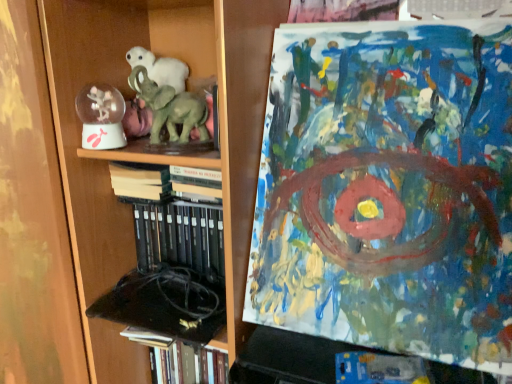
Where is `hardcover books at center, the 2th book in the bottom-to-top sequence`? Image resolution: width=512 pixels, height=384 pixels. hardcover books at center, the 2th book in the bottom-to-top sequence is located at coordinates (163, 181).

In order to face clear plastic snow globe at left, should I rotate leftwards or rightwards?

To align with it, rotate left about 19.491°.

The width and height of the screenshot is (512, 384). What do you see at coordinates (101, 117) in the screenshot?
I see `clear plastic snow globe at left` at bounding box center [101, 117].

The height and width of the screenshot is (384, 512). I want to click on hardcover book at lower left, placed as the first book when sorted from bottom to top, so click(x=181, y=359).

The width and height of the screenshot is (512, 384). What do you see at coordinates (143, 142) in the screenshot? I see `wooden bookcase at left` at bounding box center [143, 142].

Where is `abstract acrylic painting at upper right`? The width and height of the screenshot is (512, 384). abstract acrylic painting at upper right is located at coordinates (389, 189).

Is green matte elephant at center situated inside clear plastic snow globe at left or outside?

green matte elephant at center is outside clear plastic snow globe at left.

From the picture: Considering the sizes of objects green matte elephant at center and clear plastic snow globe at left in the image provided, who is smaller, green matte elephant at center or clear plastic snow globe at left?

clear plastic snow globe at left.

This screenshot has width=512, height=384. Find the location of `elephant to the right of clear plastic snow globe at left`. elephant to the right of clear plastic snow globe at left is located at coordinates (170, 108).

Is clear plastic snow globe at left at the back of green matte elephant at center?

green matte elephant at center does not have its back to clear plastic snow globe at left.

Are hardcover book at lower left, placed as the first book when sorted from bottom to top, and hardcover books at center, the first book positioned from the top, making contact?

No, hardcover book at lower left, placed as the first book when sorted from bottom to top, is not with hardcover books at center, the first book positioned from the top.

Can we say hardcover book at lower left, positioned as the 2th book in top-to-bottom order, lies outside hardcover books at center, the first book positioned from the top?

That's correct, hardcover book at lower left, positioned as the 2th book in top-to-bottom order, is outside of hardcover books at center, the first book positioned from the top.

Which is more to the right, hardcover book at lower left, placed as the first book when sorted from bottom to top, or hardcover books at center, the 2th book in the bottom-to-top sequence?

hardcover book at lower left, placed as the first book when sorted from bottom to top, is more to the right.

From a real-world perspective, which is physically above, hardcover book at lower left, placed as the first book when sorted from bottom to top, or hardcover books at center, the first book positioned from the top?

hardcover books at center, the first book positioned from the top, is physically above.

What's the angular difference between green matte elephant at center and hardcover books at center, the first book positioned from the top,'s facing directions?

24.3 degrees.

Does point (160, 141) come closer to viewer compared to point (189, 183)?

Yes.

From the image's perspective, which is below, green matte elephant at center or hardcover books at center, the first book positioned from the top?

hardcover books at center, the first book positioned from the top, appears lower in the image.

Which object is further away from the camera taking this photo, green matte elephant at center or hardcover books at center, the 2th book in the bottom-to-top sequence?

hardcover books at center, the 2th book in the bottom-to-top sequence, is behind.

Between point (86, 196) and point (165, 357), which one is positioned in front?

The point (86, 196) is in front.

From a real-world perspective, is wooden bookcase at left physically above hardcover book at lower left, positioned as the 2th book in top-to-bottom order?

Correct, in the physical world, wooden bookcase at left is higher than hardcover book at lower left, positioned as the 2th book in top-to-bottom order.

Does wooden bookcase at left have a lesser height compared to hardcover book at lower left, positioned as the 2th book in top-to-bottom order?

No.

Which is more to the left, hardcover books at center, the first book positioned from the top, or abstract acrylic painting at upper right?

hardcover books at center, the first book positioned from the top.

Locate an element on the screen. art above the hardcover books at center, the 2th book in the bottom-to-top sequence (from a real-world perspective) is located at coordinates (389, 189).

Considering the relative sizes of clear plastic snow globe at left and hardcover books at center, the first book positioned from the top, in the image provided, is clear plastic snow globe at left smaller than hardcover books at center, the first book positioned from the top,?

Yes, clear plastic snow globe at left is smaller than hardcover books at center, the first book positioned from the top.

Is clear plastic snow globe at left surrounding hardcover books at center, the 2th book in the bottom-to-top sequence?

No.

How far apart are clear plastic snow globe at left and hardcover books at center, the 2th book in the bottom-to-top sequence?

They are 5.75 inches apart.

Considering the relative positions of clear plastic snow globe at left and hardcover books at center, the 2th book in the bottom-to-top sequence, in the image provided, is clear plastic snow globe at left to the left or to the right of hardcover books at center, the 2th book in the bottom-to-top sequence,?

From the image, it's evident that clear plastic snow globe at left is to the left of hardcover books at center, the 2th book in the bottom-to-top sequence.

From the image's perspective, which one is positioned higher, wooden bookcase at left or green matte elephant at center?

green matte elephant at center.

Does wooden bookcase at left have a greater height compared to green matte elephant at center?

Indeed, wooden bookcase at left has a greater height compared to green matte elephant at center.

Based on the photo, would you say wooden bookcase at left is outside green matte elephant at center?

Yes, wooden bookcase at left is outside of green matte elephant at center.

How distant is wooden bookcase at left from green matte elephant at center?

The distance of wooden bookcase at left from green matte elephant at center is 21.56 centimeters.

Find the location of a particular element. The image size is (512, 384). toy below the green matte elephant at center (from the image's perspective) is located at coordinates (101, 117).

The height and width of the screenshot is (384, 512). Find the location of `book lying in front of the hardcover book at lower left, positioned as the 2th book in top-to-bottom order`. book lying in front of the hardcover book at lower left, positioned as the 2th book in top-to-bottom order is located at coordinates (x=163, y=181).

Estimate the real-world distances between objects in this image. Which object is closer to abstract acrylic painting at upper right, clear plastic snow globe at left or hardcover books at center, the first book positioned from the top?

hardcover books at center, the first book positioned from the top, is positioned closer to the anchor abstract acrylic painting at upper right.

Based on their spatial positions, is hardcover book at lower left, positioned as the 2th book in top-to-bottom order, or clear plastic snow globe at left further from abstract acrylic painting at upper right?

Based on the image, clear plastic snow globe at left appears to be further to abstract acrylic painting at upper right.

From the image, which object appears to be nearer to clear plastic snow globe at left, abstract acrylic painting at upper right or hardcover book at lower left, placed as the first book when sorted from bottom to top?

abstract acrylic painting at upper right lies closer to clear plastic snow globe at left than the other object.

From the image, which object appears to be nearer to abstract acrylic painting at upper right, clear plastic snow globe at left or green matte elephant at center?

Based on the image, green matte elephant at center appears to be nearer to abstract acrylic painting at upper right.

Looking at the image, which one is located further to wooden bookcase at left, abstract acrylic painting at upper right or hardcover books at center, the 2th book in the bottom-to-top sequence?

abstract acrylic painting at upper right lies further to wooden bookcase at left than the other object.

Which object lies nearer to the anchor point green matte elephant at center, clear plastic snow globe at left or abstract acrylic painting at upper right?

Among the two, clear plastic snow globe at left is located nearer to green matte elephant at center.

Based on their spatial positions, is hardcover books at center, the first book positioned from the top, or hardcover book at lower left, positioned as the 2th book in top-to-bottom order, further from wooden bookcase at left?

hardcover book at lower left, positioned as the 2th book in top-to-bottom order, lies further to wooden bookcase at left than the other object.

Looking at the image, which one is located closer to clear plastic snow globe at left, hardcover books at center, the first book positioned from the top, or wooden bookcase at left?

hardcover books at center, the first book positioned from the top, is positioned closer to the anchor clear plastic snow globe at left.

The image size is (512, 384). In order to click on bookcase between hardcover books at center, the first book positioned from the top, and hardcover book at lower left, placed as the first book when sorted from bottom to top, in the vertical direction in this screenshot , I will do `click(143, 142)`.

Where is `toy between green matte elephant at center and hardcover book at lower left, placed as the first book when sorted from bottom to top, in the vertical direction`? The image size is (512, 384). toy between green matte elephant at center and hardcover book at lower left, placed as the first book when sorted from bottom to top, in the vertical direction is located at coordinates (101, 117).

Image resolution: width=512 pixels, height=384 pixels. What are the coordinates of `book between abstract acrylic painting at upper right and hardcover book at lower left, positioned as the 2th book in top-to-bottom order, in the up-down direction` in the screenshot? It's located at (163, 181).

The height and width of the screenshot is (384, 512). Identify the location of bookcase between clear plastic snow globe at left and hardcover book at lower left, positioned as the 2th book in top-to-bottom order, in the vertical direction. (143, 142).